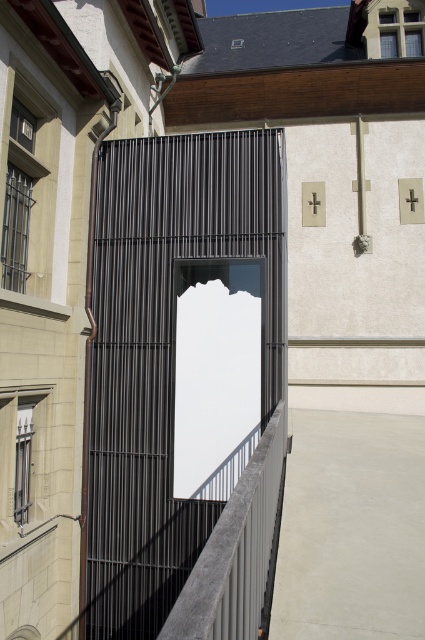
Can you confirm if smooth gray metal balustrade at center is thinner than smooth concrete hole at lower left?

No, smooth gray metal balustrade at center is not thinner than smooth concrete hole at lower left.

Does smooth gray metal balustrade at center lie behind smooth concrete hole at lower left?

No, it is in front of smooth concrete hole at lower left.

Is point (226, 563) farther from viewer compared to point (37, 636)?

That is False.

Identify the location of smooth gray metal balustrade at center. (235, 552).